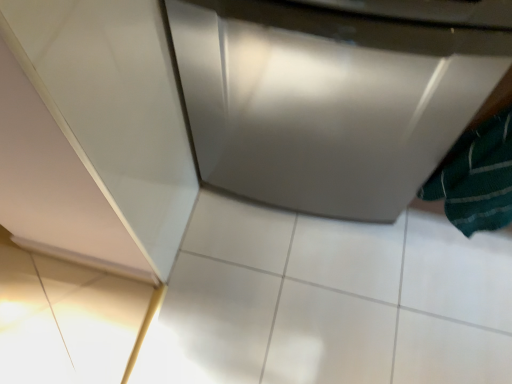
Question: From a real-world perspective, relative to green textured towel at lower right, is satin silver dishwasher at center vertically above or below?

Choices:
 (A) below
 (B) above

Answer: (A)

Question: From the image's perspective, relative to green textured towel at lower right, is satin silver dishwasher at center above or below?

Choices:
 (A) above
 (B) below

Answer: (A)

Question: Based on their positions, is satin silver dishwasher at center located to the left or right of green textured towel at lower right?

Choices:
 (A) left
 (B) right

Answer: (A)

Question: Is green textured towel at lower right bigger or smaller than satin silver dishwasher at center?

Choices:
 (A) big
 (B) small

Answer: (B)

Question: Relative to satin silver dishwasher at center, is green textured towel at lower right in front or behind?

Choices:
 (A) behind
 (B) front

Answer: (B)

Question: Is green textured towel at lower right to the left or to the right of satin silver dishwasher at center in the image?

Choices:
 (A) right
 (B) left

Answer: (A)

Question: From a real-world perspective, is green textured towel at lower right positioned above or below satin silver dishwasher at center?

Choices:
 (A) above
 (B) below

Answer: (A)